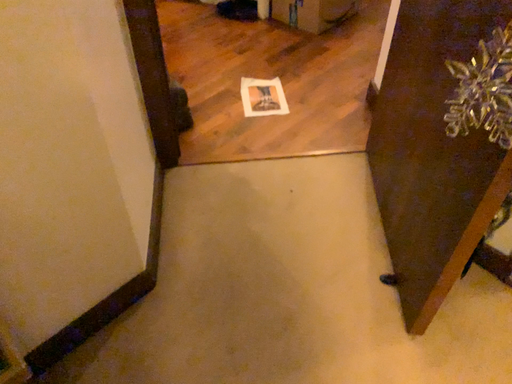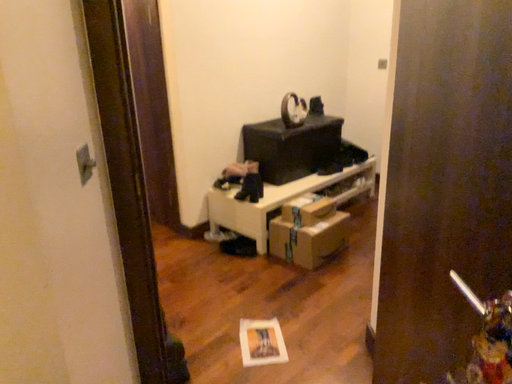
Question: How did the camera likely rotate when shooting the video?

Choices:
 (A) rotated upward
 (B) rotated downward

Answer: (A)